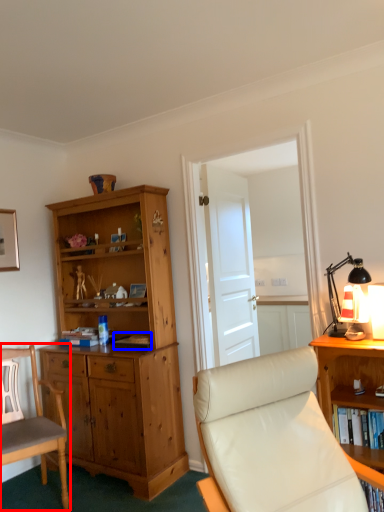
Question: Which object appears farthest to the camera in this image, chair (highlighted by a red box) or book (highlighted by a blue box)?

Choices:
 (A) chair
 (B) book

Answer: (B)